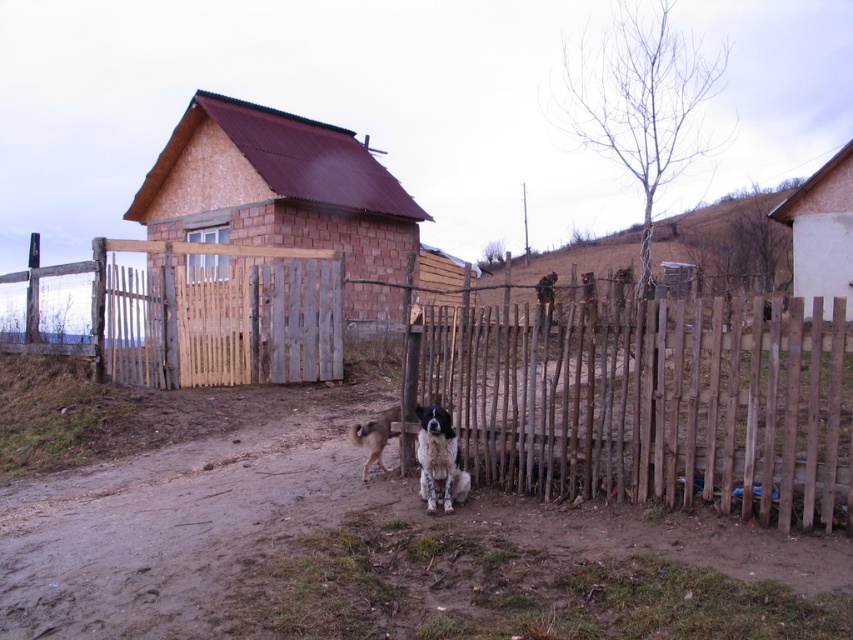
You are standing at the wooden gate with vertical slats in front of the house and want to reach the brown dirt field at upper center. Which direction should you walk to get there?

The brown dirt field at upper center is located at point [726,237], so you should walk towards the upper center direction to reach it.

You are standing in front of the house and see the brown dirt field at upper center and the fluffy white dog at center. Which object is located to the right of the other?

The brown dirt field at upper center is to the right of the fluffy white dog at center.

Based on the photo, you are a photographer planning to capture the entire scene of the brown dirt field at upper center and the fluffy white dog at center. Given that your camera frame can only accommodate one of them fully, which object should you prioritize to fit within the frame based on their sizes?

The brown dirt field at upper center is larger in size than the fluffy white dog at center, so you should prioritize capturing the fluffy white dog at center since it is smaller and more likely to fit within the camera frame.